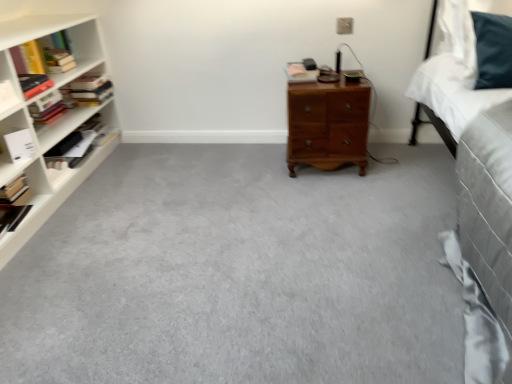
Identify the location of vacant space positioned to the left of wooden nightstand at center. (256, 169).